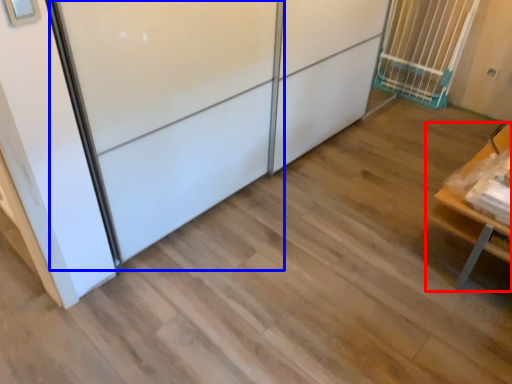
Question: Which object appears farthest to the camera in this image, furniture (highlighted by a red box) or screen door (highlighted by a blue box)?

Choices:
 (A) furniture
 (B) screen door

Answer: (A)